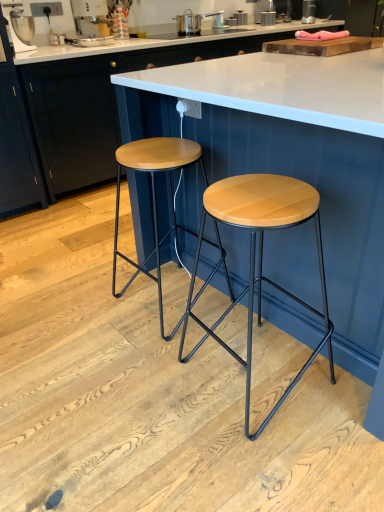
What do you see at coordinates (92, 22) in the screenshot?
I see `metallic silver coffee machine at upper left, marked as the first appliance in a left-to-right arrangement` at bounding box center [92, 22].

The height and width of the screenshot is (512, 384). What do you see at coordinates (100, 105) in the screenshot? I see `matte white countertop at center` at bounding box center [100, 105].

Describe the element at coordinates (155, 196) in the screenshot. This screenshot has width=384, height=512. I see `wooden seat stool at center, arranged as the 1th stool when viewed from the left` at that location.

This screenshot has height=512, width=384. Identify the location of wooden stool at center, which is the first stool in right-to-left order. (259, 255).

Where is `metallic silver coffee machine at upper left, which is the second appliance in top-to-bottom order`? metallic silver coffee machine at upper left, which is the second appliance in top-to-bottom order is located at coordinates (92, 22).

Would you say wooden stool at center, which is the first stool in right-to-left order, contains metallic silver coffee machine at upper left, marked as the first appliance in a left-to-right arrangement?

Actually, metallic silver coffee machine at upper left, marked as the first appliance in a left-to-right arrangement, is outside wooden stool at center, which is the first stool in right-to-left order.

From a real-world perspective, is wooden stool at center, which is the first stool in right-to-left order, below metallic silver coffee machine at upper left, arranged as the 1th appliance when ordered from the bottom?

Yes, from a real-world perspective, wooden stool at center, which is the first stool in right-to-left order, is below metallic silver coffee machine at upper left, arranged as the 1th appliance when ordered from the bottom.

Can you confirm if wooden stool at center, the second stool viewed from the left, is shorter than metallic silver coffee machine at upper left, which ranks as the 2th appliance in back-to-front order?

Incorrect, the height of wooden stool at center, the second stool viewed from the left, does not fall short of that of metallic silver coffee machine at upper left, which ranks as the 2th appliance in back-to-front order.

From the image's perspective, would you say wooden stool at center, which is the first stool in right-to-left order, is positioned over metallic silver coffee machine at upper left, which is the second appliance in top-to-bottom order?

Incorrect, from the image's perspective, wooden stool at center, which is the first stool in right-to-left order, is lower than metallic silver coffee machine at upper left, which is the second appliance in top-to-bottom order.

Looking at this image, from the image's perspective, which one is positioned higher, wooden seat stool at center, arranged as the 1th stool when viewed from the left, or metallic silver coffee machine at upper left, marked as the first appliance in a left-to-right arrangement?

metallic silver coffee machine at upper left, marked as the first appliance in a left-to-right arrangement.

From their relative heights in the image, would you say wooden seat stool at center, arranged as the 1th stool when viewed from the left, is taller or shorter than metallic silver coffee machine at upper left, marked as the first appliance in a left-to-right arrangement?

Clearly, wooden seat stool at center, arranged as the 1th stool when viewed from the left, is taller compared to metallic silver coffee machine at upper left, marked as the first appliance in a left-to-right arrangement.

Is point (158, 260) positioned after point (105, 16)?

No, it is in front of (105, 16).

Considering the sizes of objects wooden seat stool at center, arranged as the 1th stool when viewed from the left, and metallic silver coffee machine at upper left, which is the 2th appliance in right-to-left order, in the image provided, who is bigger, wooden seat stool at center, arranged as the 1th stool when viewed from the left, or metallic silver coffee machine at upper left, which is the 2th appliance in right-to-left order,?

wooden seat stool at center, arranged as the 1th stool when viewed from the left.

From a real-world perspective, does wooden table at center stand above matte white countertop at center?

Actually, wooden table at center is physically below matte white countertop at center in the real world.

From the image's perspective, between wooden table at center and matte white countertop at center, which one is located above?

matte white countertop at center appears higher in the image.

In terms of width, does wooden table at center look wider or thinner when compared to matte white countertop at center?

Clearly, wooden table at center has more width compared to matte white countertop at center.

Is wooden table at center taller than matte white countertop at center?

Incorrect, the height of wooden table at center is not larger of that of matte white countertop at center.

Considering the positions of objects wooden table at center and metallic silver coffee machine at upper left, marked as the first appliance in a left-to-right arrangement, in the image provided, who is more to the right, wooden table at center or metallic silver coffee machine at upper left, marked as the first appliance in a left-to-right arrangement,?

From the viewer's perspective, wooden table at center appears more on the right side.

From the image's perspective, is wooden table at center positioned above or below metallic silver coffee machine at upper left, arranged as the 1th appliance when ordered from the bottom?

wooden table at center is situated lower than metallic silver coffee machine at upper left, arranged as the 1th appliance when ordered from the bottom, in the image.

Looking at this image, is wooden table at center turned away from metallic silver coffee machine at upper left, acting as the 1th appliance starting from the front?

Correct, wooden table at center is looking away from metallic silver coffee machine at upper left, acting as the 1th appliance starting from the front.

From a real-world perspective, is wooden table at center physically located above or below metallic silver coffee machine at upper left, which is the 2th appliance in right-to-left order?

wooden table at center is below metallic silver coffee machine at upper left, which is the 2th appliance in right-to-left order.

Is matte white countertop at center bigger than wooden stool at center, which is the first stool in right-to-left order?

Yes.

Which is nearer, (98, 110) or (305, 368)?

Point (98, 110).

From a real-world perspective, who is located higher, matte white countertop at center or wooden stool at center, the second stool viewed from the left?

From a 3D spatial view, matte white countertop at center is above.

Would you say matte white countertop at center is a long distance from wooden stool at center, which is the first stool in right-to-left order?

matte white countertop at center is far away from wooden stool at center, which is the first stool in right-to-left order.

Is matte white countertop at center with metallic silver toaster at upper center, which appears as the 1th appliance when viewed from the top?

No, matte white countertop at center is not touching metallic silver toaster at upper center, which appears as the 1th appliance when viewed from the top.

From the image's perspective, is matte white countertop at center beneath metallic silver toaster at upper center, the first appliance positioned from the back?

Yes, from the image's perspective, matte white countertop at center is below metallic silver toaster at upper center, the first appliance positioned from the back.

From a real-world perspective, which is physically above, matte white countertop at center or metallic silver toaster at upper center, the 2th appliance in the bottom-to-top sequence?

metallic silver toaster at upper center, the 2th appliance in the bottom-to-top sequence, from a real-world perspective.

Which object is positioned more to the left, matte white countertop at center or metallic silver toaster at upper center, placed as the second appliance when sorted from left to right?

matte white countertop at center.

Is wooden table at center not inside metallic silver toaster at upper center, placed as the second appliance when sorted from left to right?

wooden table at center lies outside metallic silver toaster at upper center, placed as the second appliance when sorted from left to right,'s area.

From the image's perspective, which appliance is the 2nd one above the wooden table at center? Please provide its 2D coordinates.

[(308, 11)]

Which is more to the right, wooden table at center or metallic silver toaster at upper center, arranged as the first appliance when viewed from the right?

metallic silver toaster at upper center, arranged as the first appliance when viewed from the right.

From a real-world perspective, is wooden table at center physically above metallic silver toaster at upper center, the 2th appliance in the bottom-to-top sequence?

Actually, wooden table at center is physically below metallic silver toaster at upper center, the 2th appliance in the bottom-to-top sequence, in the real world.

I want to click on stool that is the 2nd one when counting forward from the metallic silver coffee machine at upper left, which is the 2th appliance in right-to-left order, so click(259, 255).

There is a wooden seat stool at center, arranged as the 1th stool when viewed from the left. Where is `the 2nd appliance above it (from a real-world perspective)`? The image size is (384, 512). the 2nd appliance above it (from a real-world perspective) is located at coordinates (92, 22).

Looking at the image, which one is located further to metallic silver toaster at upper center, the first appliance positioned from the back, wooden stool at center, the second stool viewed from the left, or wooden seat stool at center, arranged as the 1th stool when viewed from the left?

The object further to metallic silver toaster at upper center, the first appliance positioned from the back, is wooden stool at center, the second stool viewed from the left.

Based on the photo, from the image, which object appears to be farther from metallic silver toaster at upper center, the 2th appliance in the bottom-to-top sequence, metallic silver coffee machine at upper left, which is the 2th appliance in right-to-left order, or wooden table at center?

wooden table at center is positioned further to the anchor metallic silver toaster at upper center, the 2th appliance in the bottom-to-top sequence.

Which object lies further to the anchor point wooden seat stool at center, arranged as the 1th stool when viewed from the left, metallic silver toaster at upper center, which ranks as the 2th appliance in front-to-back order, or metallic silver coffee machine at upper left, which is the second appliance in top-to-bottom order?

metallic silver toaster at upper center, which ranks as the 2th appliance in front-to-back order, is further to wooden seat stool at center, arranged as the 1th stool when viewed from the left.

Based on their spatial positions, is metallic silver coffee machine at upper left, which is the 2th appliance in right-to-left order, or wooden seat stool at center, marked as the second stool in a right-to-left arrangement, further from metallic silver toaster at upper center, which appears as the 1th appliance when viewed from the top?

wooden seat stool at center, marked as the second stool in a right-to-left arrangement, is positioned further to the anchor metallic silver toaster at upper center, which appears as the 1th appliance when viewed from the top.

Looking at the image, which one is located further to metallic silver toaster at upper center, the first appliance positioned from the back, wooden seat stool at center, marked as the second stool in a right-to-left arrangement, or metallic silver coffee machine at upper left, acting as the 1th appliance starting from the front?

wooden seat stool at center, marked as the second stool in a right-to-left arrangement, is positioned further to the anchor metallic silver toaster at upper center, the first appliance positioned from the back.

From the image, which object appears to be nearer to metallic silver coffee machine at upper left, marked as the first appliance in a left-to-right arrangement, matte white countertop at center or wooden stool at center, the second stool viewed from the left?

Among the two, matte white countertop at center is located nearer to metallic silver coffee machine at upper left, marked as the first appliance in a left-to-right arrangement.

When comparing their distances from wooden table at center, does wooden seat stool at center, marked as the second stool in a right-to-left arrangement, or matte white countertop at center seem further?

matte white countertop at center is further to wooden table at center.

Looking at the image, which one is located further to metallic silver coffee machine at upper left, arranged as the 1th appliance when ordered from the bottom, wooden table at center or wooden stool at center, the second stool viewed from the left?

wooden stool at center, the second stool viewed from the left, is positioned further to the anchor metallic silver coffee machine at upper left, arranged as the 1th appliance when ordered from the bottom.

The width and height of the screenshot is (384, 512). In order to click on stool that lies between metallic silver coffee machine at upper left, marked as the first appliance in a left-to-right arrangement, and wooden stool at center, the second stool viewed from the left, from top to bottom in this screenshot , I will do `click(155, 196)`.

This screenshot has width=384, height=512. Find the location of `stool situated between wooden seat stool at center, arranged as the 1th stool when viewed from the left, and wooden table at center from left to right`. stool situated between wooden seat stool at center, arranged as the 1th stool when viewed from the left, and wooden table at center from left to right is located at coordinates (259, 255).

Identify the location of stool between wooden stool at center, the second stool viewed from the left, and metallic silver toaster at upper center, which ranks as the 2th appliance in front-to-back order, in the front-back direction. (155, 196).

Identify the location of cabinetry between wooden stool at center, which is the first stool in right-to-left order, and metallic silver toaster at upper center, the first appliance positioned from the back, from front to back. The image size is (384, 512). 100,105.